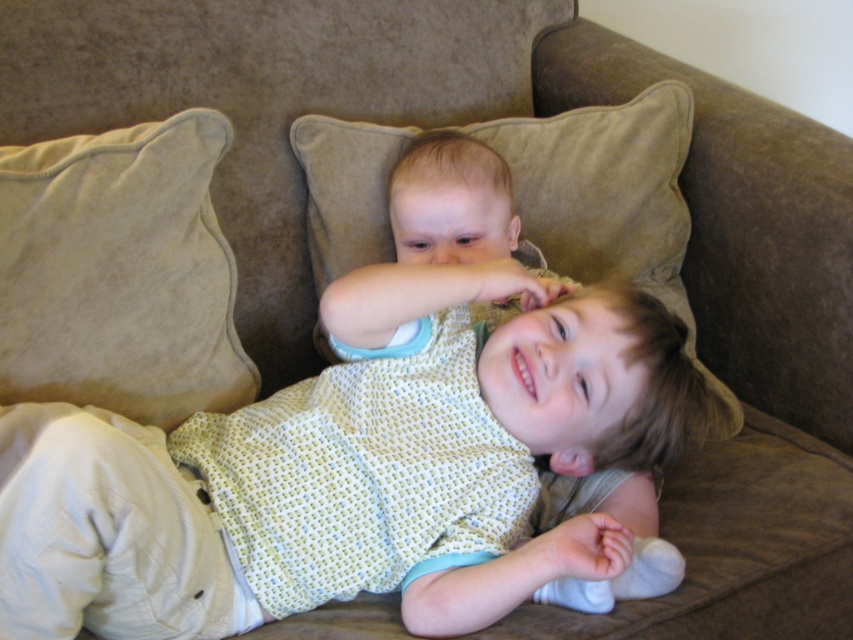
You are helping to arrange pillows on a couch for a cozy reading corner. You have two beige suede pillows. The beige suede pillow at left and the beige suede pillow at center. According to the scene, which pillow is placed underneath the other?

The beige suede pillow at left is positioned under the beige suede pillow at center, so the left one is underneath the center one.

You are arranging two beige suede pillows on a couch. The scene shows the beige suede pillow at left and the beige suede pillow at center. Which pillow is located to the right of the other?

The beige suede pillow at center is located to the right of the beige suede pillow at left.